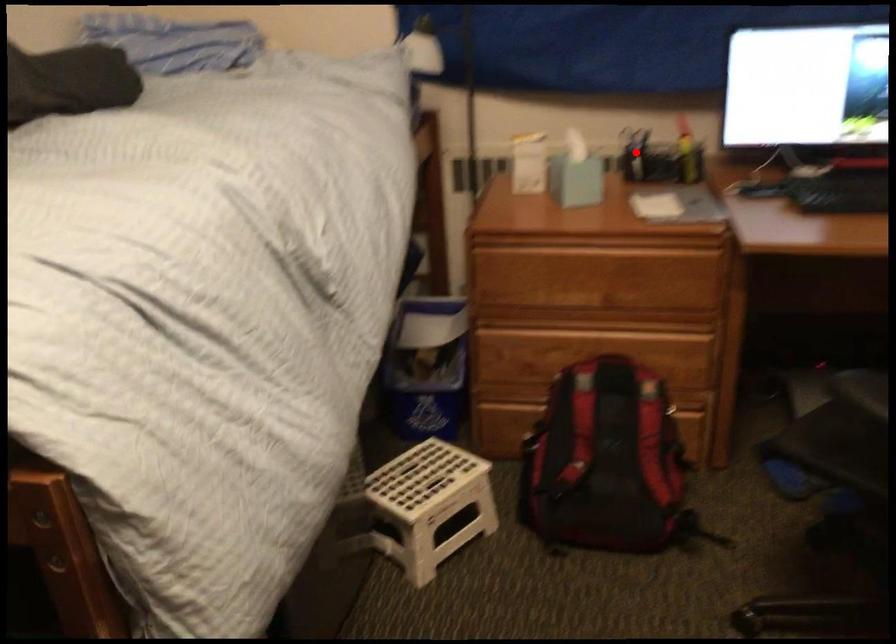
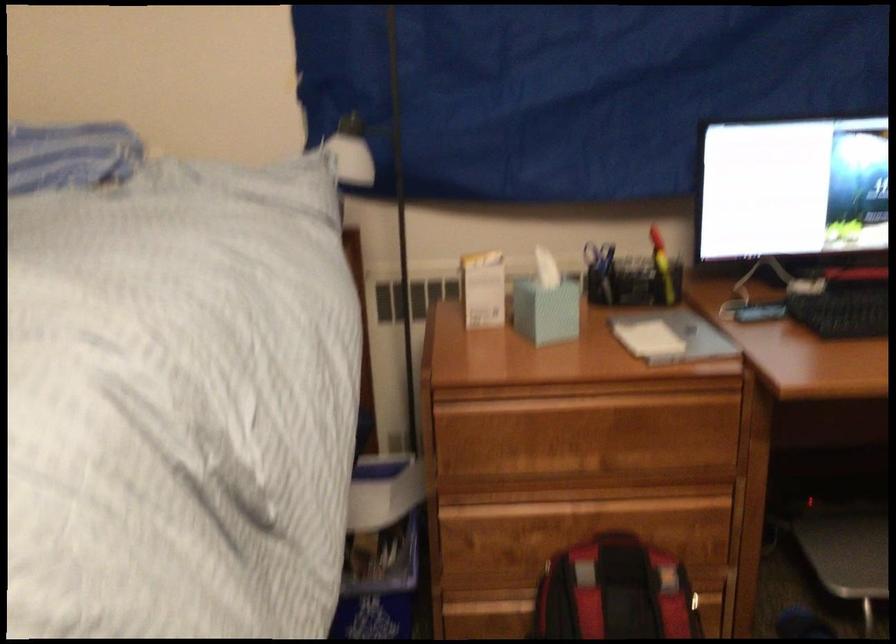
Where in the second image is the point corresponding to the highlighted location from the first image?

(599, 272)